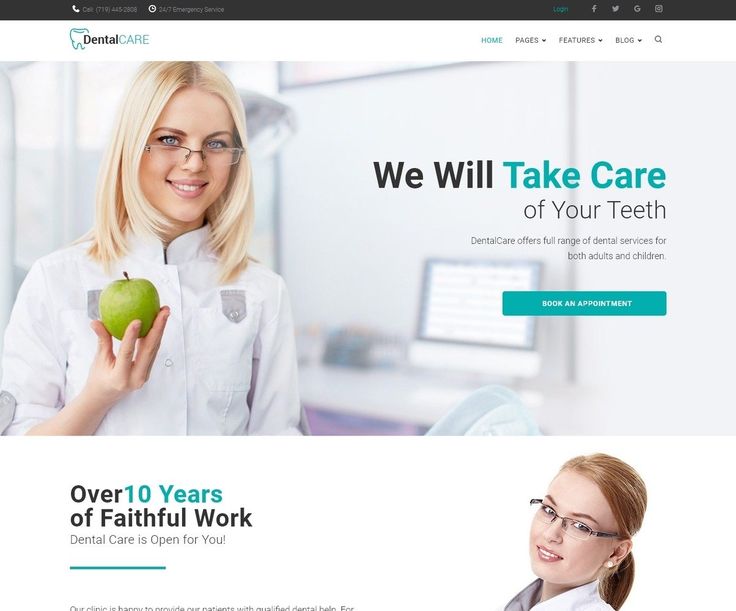
I want to click on computer, so click(469, 322).